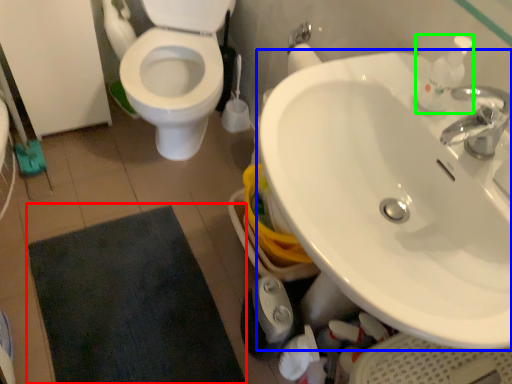
Question: Estimate the real-world distances between objects in this image. Which object is closer to bath mat (highlighted by a red box), sink (highlighted by a blue box) or soap dispenser (highlighted by a green box)?

Choices:
 (A) sink
 (B) soap dispenser

Answer: (A)